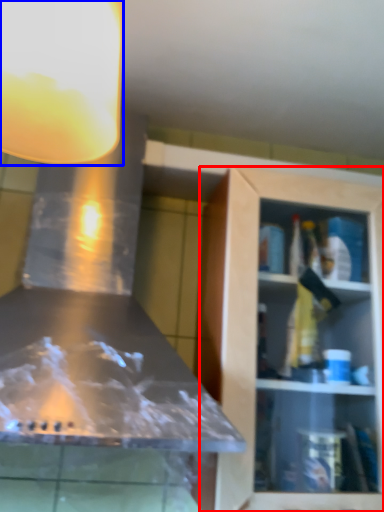
Question: Which point is closer to the camera, cabinetry (highlighted by a red box) or light fixture (highlighted by a blue box)?

Choices:
 (A) cabinetry
 (B) light fixture

Answer: (B)